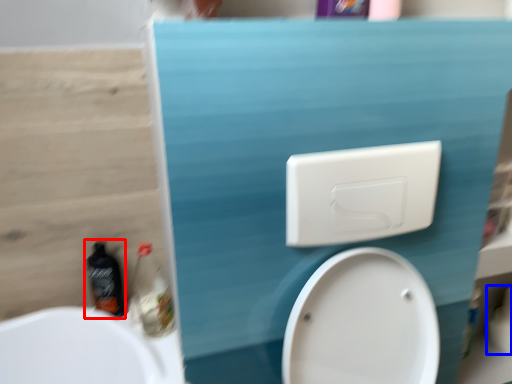
Question: Which point is closer to the camera, bottle (highlighted by a red box) or toilet paper (highlighted by a blue box)?

Choices:
 (A) bottle
 (B) toilet paper

Answer: (A)